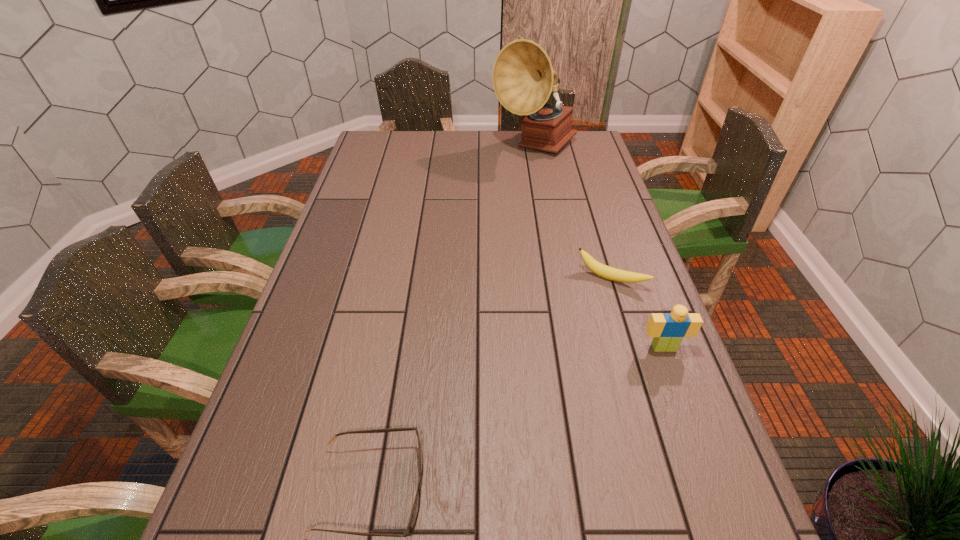
Locate an element on the screen. Image resolution: width=960 pixels, height=540 pixels. vacant space situated on the horn of the phonograph record is located at coordinates (533, 185).

This screenshot has height=540, width=960. Identify the location of vacant space located on the horn of the phonograph record. (532, 198).

In order to click on vacant region located on the horn of the phonograph record in this screenshot , I will do point(531,228).

Locate an element on the screen. The width and height of the screenshot is (960, 540). object located at the far edge is located at coordinates (523, 78).

Locate an element on the screen. Lego present at the right edge is located at coordinates (668, 330).

Locate an element on the screen. This screenshot has width=960, height=540. banana that is at the right edge is located at coordinates (607, 272).

This screenshot has width=960, height=540. What are the coordinates of `phonograph record present at the right edge` in the screenshot? It's located at (523, 78).

The width and height of the screenshot is (960, 540). In order to click on object located in the far right corner section of the desktop in this screenshot , I will do `click(523, 78)`.

Where is `vacant space at the far edge of the desktop`? The width and height of the screenshot is (960, 540). vacant space at the far edge of the desktop is located at coordinates (532, 159).

The width and height of the screenshot is (960, 540). What are the coordinates of `vacant region at the left edge of the desktop` in the screenshot? It's located at (378, 247).